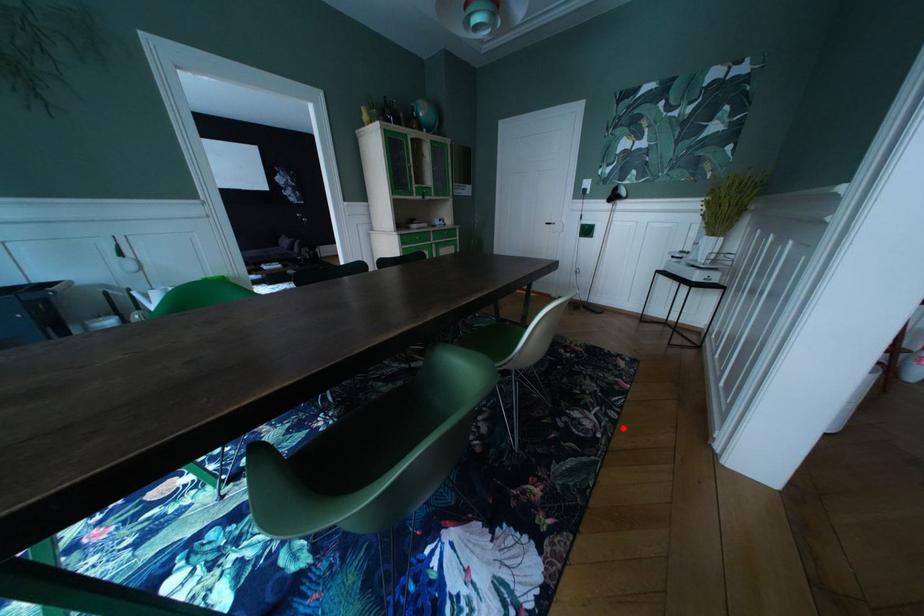
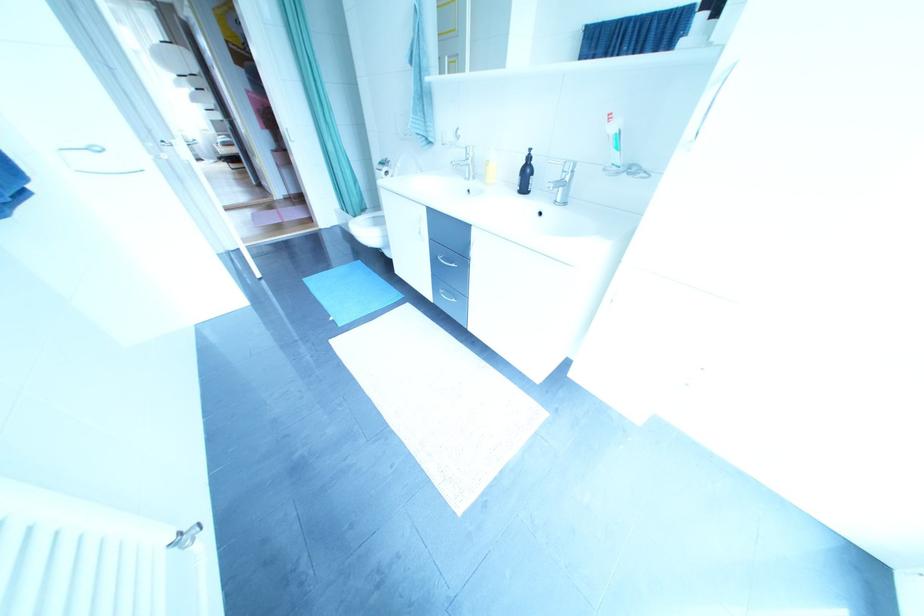
Question: I am providing you with two images of the same scene from different viewpoints. A red point is marked on the first image. Can you still see the location of the red point in image 2?

Choices:
 (A) Yes
 (B) No

Answer: (B)